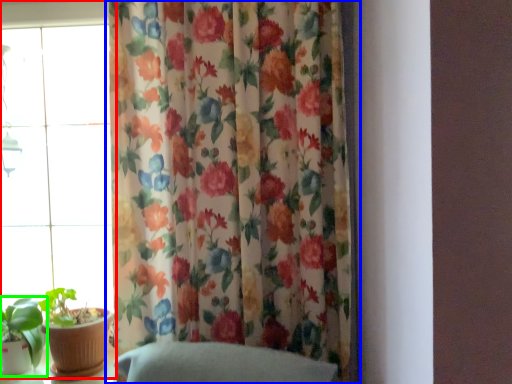
Question: Which object is the farthest from window (highlighted by a red box)? Choose among these: curtain (highlighted by a blue box) or houseplant (highlighted by a green box).

Choices:
 (A) curtain
 (B) houseplant

Answer: (A)